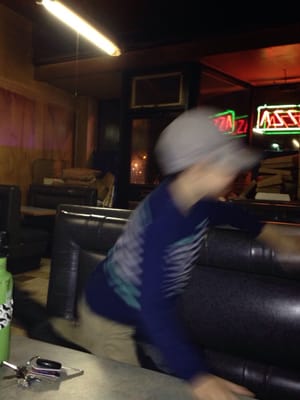
The width and height of the screenshot is (300, 400). I want to click on restaurant seats, so click(223, 314), click(53, 200), click(10, 200).